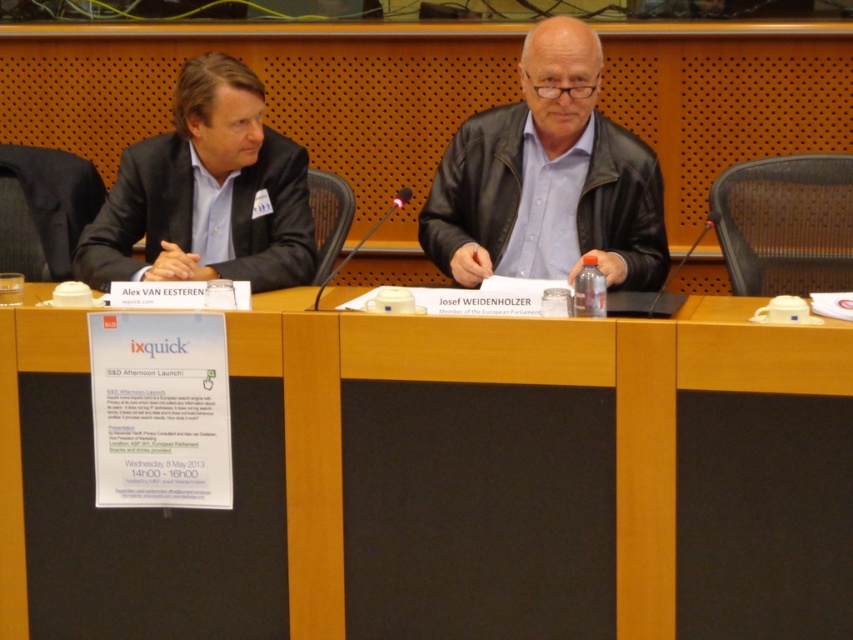
Question: Among these objects, which one is farthest from the camera?

Choices:
 (A) matte black suit at left
 (B) wooden at center
 (C) leather jacket at center

Answer: (C)

Question: Which point is farther to the camera?

Choices:
 (A) (459, 163)
 (B) (28, 417)
 (C) (300, 282)

Answer: (A)

Question: Can you confirm if wooden at center is smaller than leather jacket at center?

Choices:
 (A) no
 (B) yes

Answer: (A)

Question: Which point appears closest to the camera in this image?

Choices:
 (A) (221, 632)
 (B) (605, 214)
 (C) (236, 108)

Answer: (A)

Question: Can you confirm if leather jacket at center is bigger than matte black suit at left?

Choices:
 (A) yes
 (B) no

Answer: (A)

Question: Is leather jacket at center thinner than matte black suit at left?

Choices:
 (A) yes
 (B) no

Answer: (B)